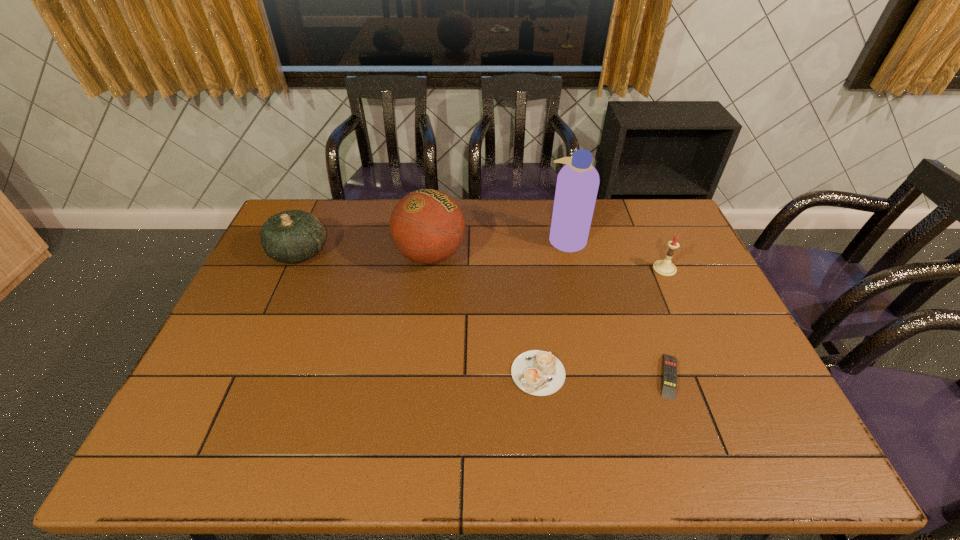
Identify the location of free space between the candle and the basketball. (547, 262).

Locate an element on the screen. empty space between the candle and the gourd is located at coordinates (482, 260).

The image size is (960, 540). Identify the location of free space between the third object from right to left and the fourth tallest object. (615, 254).

Identify the location of free space that is in between the third shortest object and the shortest object. Image resolution: width=960 pixels, height=540 pixels. (666, 322).

Where is `vacant region between the basketball and the fourth object from right to left`? vacant region between the basketball and the fourth object from right to left is located at coordinates (485, 314).

Where is `unoccupied position between the fourth shortest object and the candle`? This screenshot has height=540, width=960. unoccupied position between the fourth shortest object and the candle is located at coordinates (482, 260).

Find the location of a particular element. Image resolution: width=960 pixels, height=540 pixels. free space between the fifth object from right to left and the fourth shortest object is located at coordinates (365, 254).

At what (x,y) coordinates should I click in order to perform the action: click on free space that is in between the leftmost object and the basketball. Please return your answer as a coordinate pair (x, y). Looking at the image, I should click on (365, 254).

This screenshot has height=540, width=960. I want to click on free point between the candle and the third tallest object, so click(482, 260).

You are a GUI agent. You are given a task and a screenshot of the screen. Output one action in this format:
    pyautogui.click(x=<x>, y=<y>)
    Task: Click on the second closest object to the third tallest object
    The image size is (960, 540).
    Given the screenshot: What is the action you would take?
    pyautogui.click(x=536, y=372)